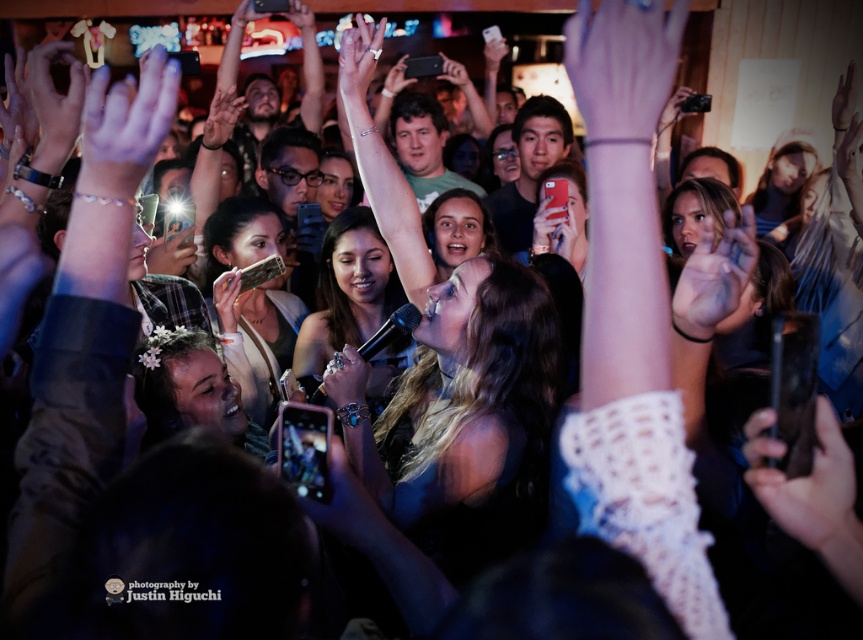
You are a photographer at the concert. You want to take a photo of the matte black phone at center without the white knitted glove at upper center blocking it. What should you do?

The white knitted glove at upper center is positioned over the matte black phone at center, so you should move the white knitted glove at upper center to the side or adjust your angle to avoid the obstruction.

You are a photographer at the concert. You need to capture a closeup shot of the performer. The transparent skin at center and the matte black phone at center are both in the frame. Which object is wider so that it might block the performer?

The transparent skin at center is wider than the matte black phone at center, so it might block the performer more.

You are standing at the center of the concert venue and see two points marked in the image. The first point is at coordinate point (x=723, y=266) and the second is at coordinate point (x=222, y=301). Which point is closer to you?

Point (x=723, y=266) is in front of point (x=222, y=301), so the first point is closer to you.